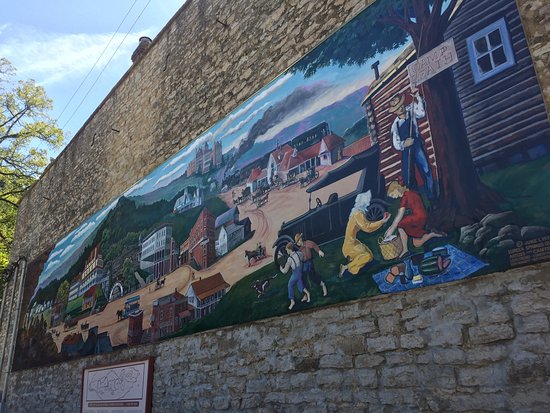
Identify the location of wall. The height and width of the screenshot is (413, 550). (371, 314).